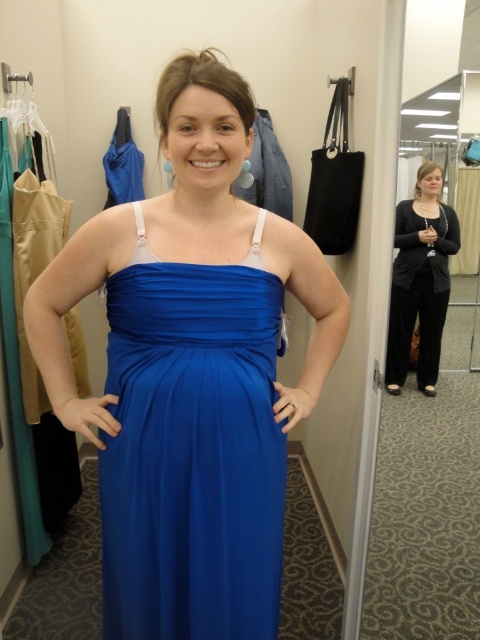
In the scene shown: Between royal satin dress at center and black matte cardigan at center, which one appears on the left side from the viewer's perspective?

Positioned to the left is royal satin dress at center.

Who is more distant from viewer, (178, 308) or (441, 323)?

Point (441, 323)

Does point (243, 348) lie in front of point (400, 241)?

That is True.

Locate an element on the screen. Image resolution: width=480 pixels, height=640 pixels. royal satin dress at center is located at coordinates (191, 372).

Can you confirm if royal blue satin dress at center is positioned to the right of black matte cardigan at center?

Incorrect, royal blue satin dress at center is not on the right side of black matte cardigan at center.

Describe the element at coordinates (192, 449) in the screenshot. The image size is (480, 640). I see `royal blue satin dress at center` at that location.

What do you see at coordinates (192, 449) in the screenshot? I see `royal blue satin dress at center` at bounding box center [192, 449].

The image size is (480, 640). In order to click on royal blue satin dress at center in this screenshot , I will do `click(192, 449)`.

Is royal satin dress at center thinner than royal blue satin dress at center?

Incorrect, royal satin dress at center's width is not less than royal blue satin dress at center's.

Is point (240, 490) behind point (127, 312)?

Yes, it is.

Where is `royal satin dress at center`? royal satin dress at center is located at coordinates (191, 372).